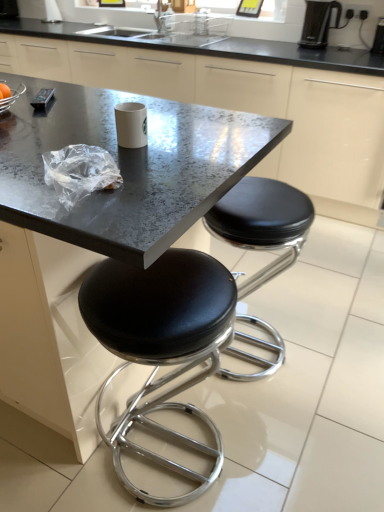
Identify the location of vacant point to the left of black plastic coffee maker at upper right. This screenshot has height=512, width=384. tap(363, 49).